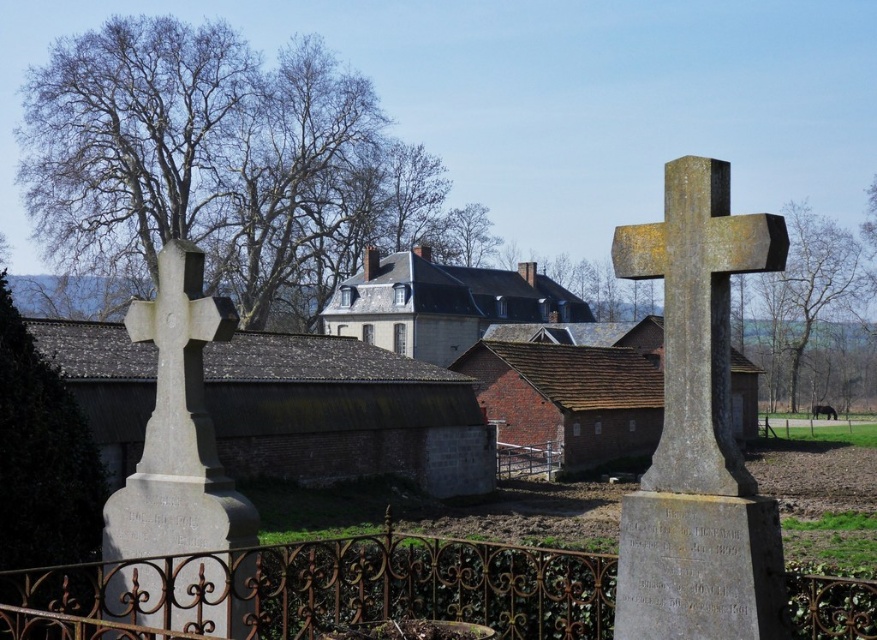
Which of these two, bare wood tree at upper right or brown textured tree at upper center, stands taller?

With more height is bare wood tree at upper right.

Which is above, bare wood tree at upper right or brown textured tree at upper center?

brown textured tree at upper center is higher up.

Is point (833, 257) positioned after point (440, 250)?

Yes, point (833, 257) is behind point (440, 250).

The height and width of the screenshot is (640, 877). What are the coordinates of `bare wood tree at upper right` in the screenshot? It's located at (809, 296).

Is gray stone cross at right to the left of brown textured tree at upper center from the viewer's perspective?

No, gray stone cross at right is not to the left of brown textured tree at upper center.

Between gray stone cross at right and brown textured tree at upper center, which one has less height?

gray stone cross at right is shorter.

Is point (710, 200) positioned in front of point (474, 236)?

Yes.

Find the location of a particular element. gray stone cross at right is located at coordinates (697, 320).

Is iron ornate fence at lower center shorter than bare wood tree at upper right?

Correct, iron ornate fence at lower center is not as tall as bare wood tree at upper right.

Is iron ornate fence at lower center to the right of bare wood tree at upper right from the viewer's perspective?

No, iron ornate fence at lower center is not to the right of bare wood tree at upper right.

The height and width of the screenshot is (640, 877). I want to click on iron ornate fence at lower center, so (x=318, y=589).